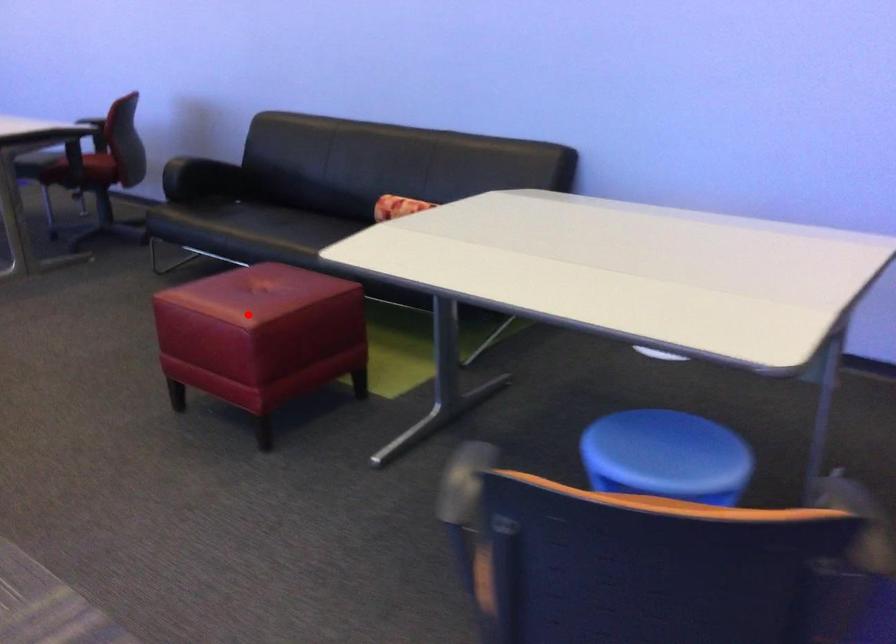
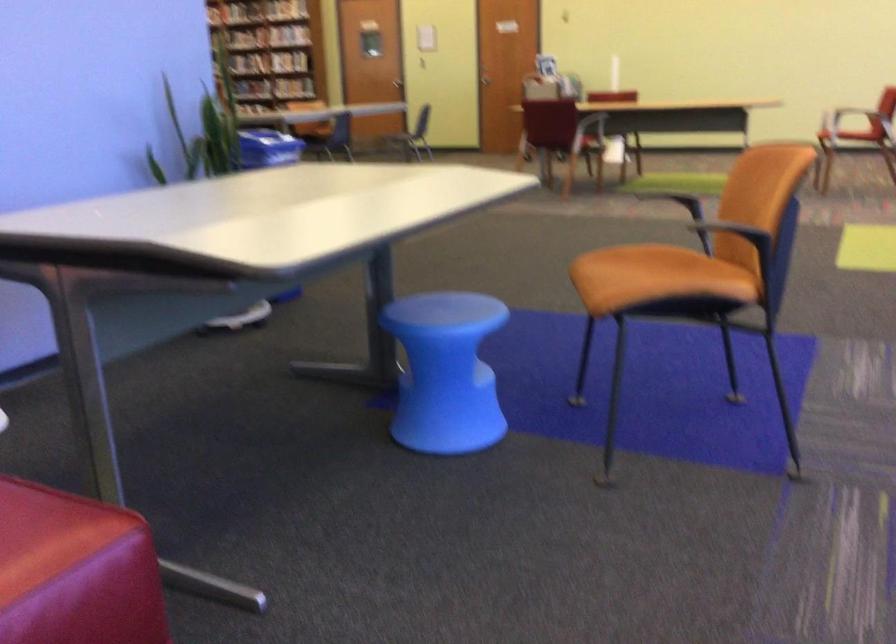
In the second image, find the point that corresponds to the highlighted location in the first image.

(47, 534)